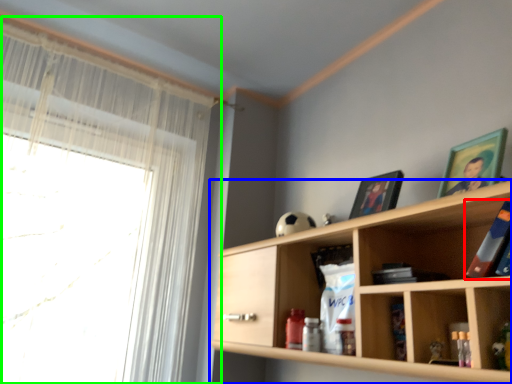
Question: Based on their relative distances, which object is farther from book (highlighted by a red box)? Choose from shelf (highlighted by a blue box) and window (highlighted by a green box).

Choices:
 (A) shelf
 (B) window

Answer: (B)